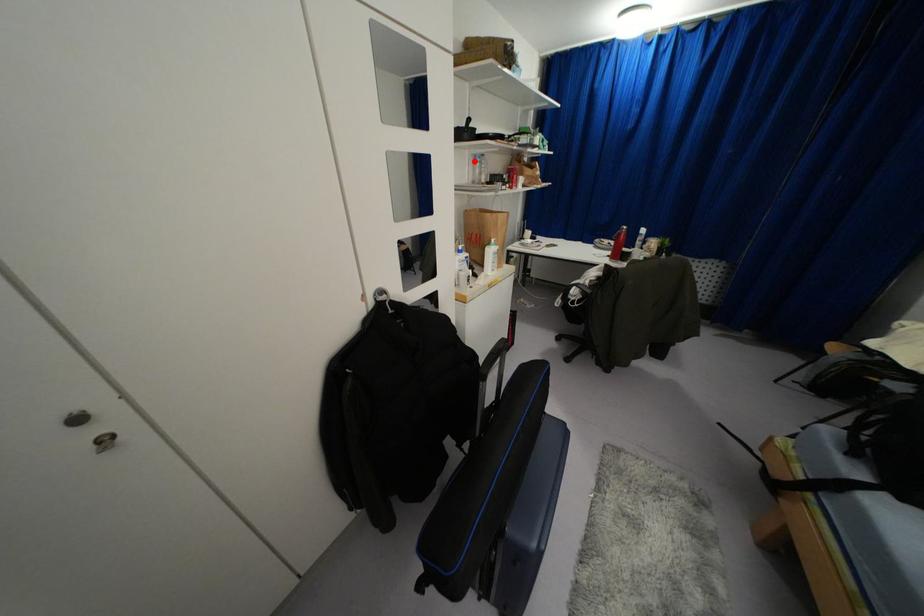
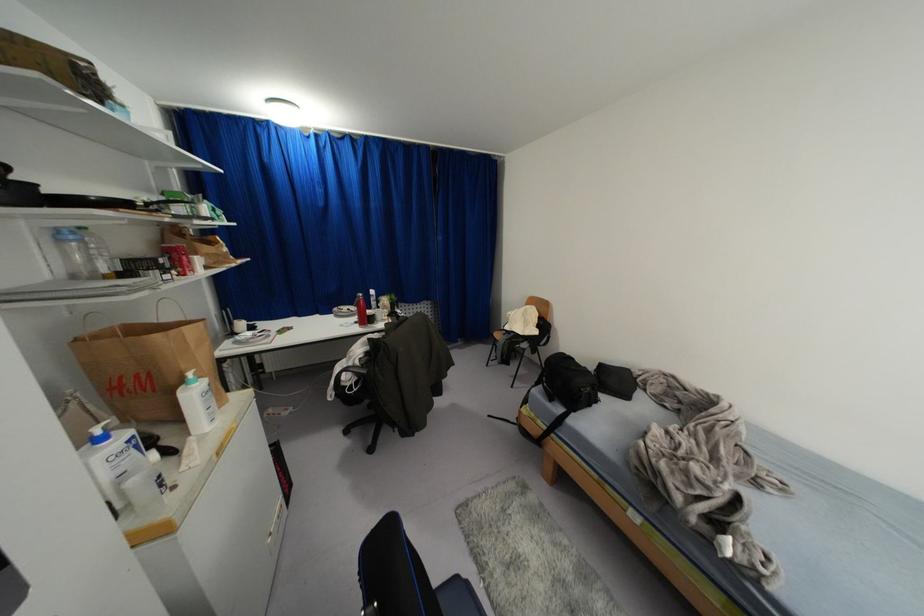
Question: I am providing you with two images of the same scene from different viewpoints. Image1 has a red point marked. In image2, the corresponding 3D location appears at what relative position? Reply with the corresponding letter.

Choices:
 (A) Closer
 (B) Farther

Answer: (B)